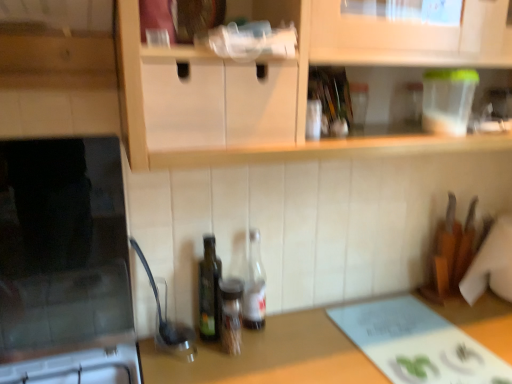
Identify the location of free spot above brown wooden countertop at center (from a real-world perspective). (374, 340).